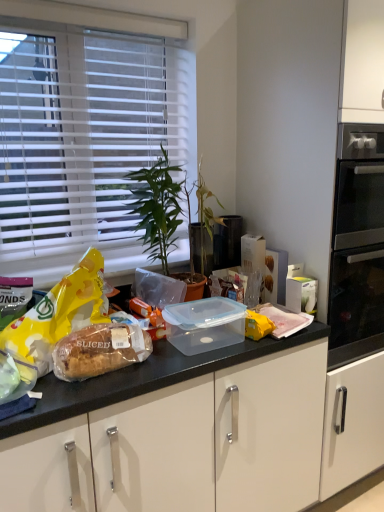
Question: Does green leafy plant at center turn towards yellow matte snack at left?

Choices:
 (A) no
 (B) yes

Answer: (A)

Question: Would you say green leafy plant at center is outside yellow matte snack at left?

Choices:
 (A) no
 (B) yes

Answer: (B)

Question: Is green leafy plant at center taller than yellow matte snack at left?

Choices:
 (A) no
 (B) yes

Answer: (B)

Question: From the image's perspective, does green leafy plant at center appear lower than yellow matte snack at left?

Choices:
 (A) yes
 (B) no

Answer: (B)

Question: Does green leafy plant at center appear on the right side of yellow matte snack at left?

Choices:
 (A) yes
 (B) no

Answer: (A)

Question: Is green leafy plant at center spatially inside yellow matte snack at left, or outside of it?

Choices:
 (A) inside
 (B) outside

Answer: (B)

Question: From their relative heights in the image, would you say green leafy plant at center is taller or shorter than yellow matte snack at left?

Choices:
 (A) tall
 (B) short

Answer: (A)

Question: Is point (137, 226) closer or farther from the camera than point (97, 250)?

Choices:
 (A) closer
 (B) farther

Answer: (A)

Question: Considering their positions, is green leafy plant at center located in front of or behind yellow matte snack at left?

Choices:
 (A) front
 (B) behind

Answer: (B)

Question: In terms of height, does yellow matte snack at left look taller or shorter compared to sliced bread at center?

Choices:
 (A) tall
 (B) short

Answer: (A)

Question: Considering the positions of point (81, 261) and point (127, 325), is point (81, 261) closer or farther from the camera than point (127, 325)?

Choices:
 (A) closer
 (B) farther

Answer: (B)

Question: In the image, is yellow matte snack at left positioned in front of or behind sliced bread at center?

Choices:
 (A) behind
 (B) front

Answer: (B)

Question: In terms of size, does yellow matte snack at left appear bigger or smaller than sliced bread at center?

Choices:
 (A) big
 (B) small

Answer: (A)

Question: From a real-world perspective, is sliced bread at center positioned above or below yellow matte snack at left?

Choices:
 (A) above
 (B) below

Answer: (B)

Question: In the image, is sliced bread at center on the left side or the right side of yellow matte snack at left?

Choices:
 (A) right
 (B) left

Answer: (A)